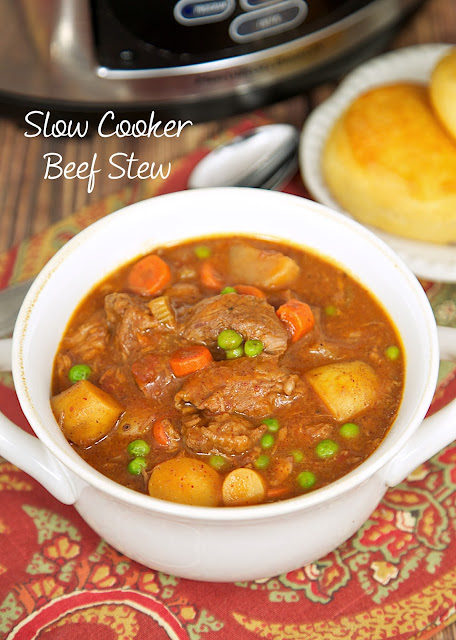
Where is `bowl`? The height and width of the screenshot is (640, 456). bowl is located at coordinates (419, 339).